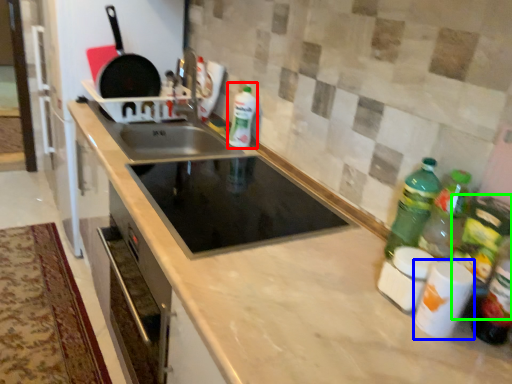
Question: Which object is the farthest from bottle (highlighted by a red box)? Choose among these: appliance (highlighted by a blue box) or bottle (highlighted by a green box).

Choices:
 (A) appliance
 (B) bottle

Answer: (A)